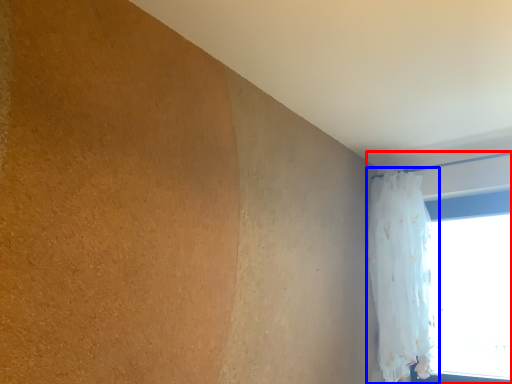
Question: Which object is further to the camera taking this photo, window (highlighted by a red box) or curtain (highlighted by a blue box)?

Choices:
 (A) window
 (B) curtain

Answer: (A)